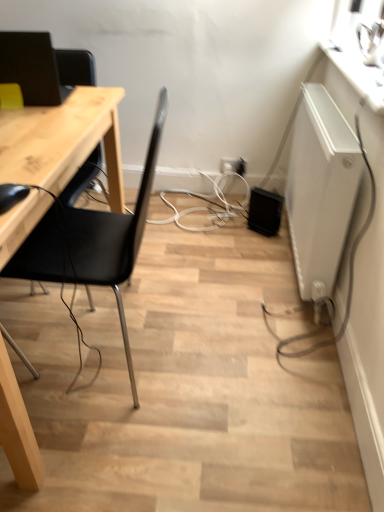
Question: In the image, is white glossy counter top at upper right positioned in front of or behind white plastic electric outlet at center, which is the first electric outlet in left-to-right order?

Choices:
 (A) behind
 (B) front

Answer: (B)

Question: Considering the positions of white glossy counter top at upper right and white plastic electric outlet at center, the 2th electric outlet from the right, in the image, is white glossy counter top at upper right wider or thinner than white plastic electric outlet at center, the 2th electric outlet from the right,?

Choices:
 (A) thin
 (B) wide

Answer: (B)

Question: Estimate the real-world distances between objects in this image. Which object is closer to the white plastic electric outlet at center, which is the first electric outlet in left-to-right order?

Choices:
 (A) matte black monitor at upper left
 (B) white glossy counter top at upper right
 (C) black matte chair at left
 (D) white matte radiator at right
 (E) white plastic electric outlet at center, marked as the second electric outlet in a left-to-right arrangement

Answer: (E)

Question: Which object is the closest to the white glossy counter top at upper right?

Choices:
 (A) black matte chair at left
 (B) white plastic electric outlet at center, marked as the second electric outlet in a left-to-right arrangement
 (C) white matte radiator at right
 (D) white plastic electric outlet at center, which is the first electric outlet in left-to-right order
 (E) matte black monitor at upper left

Answer: (C)